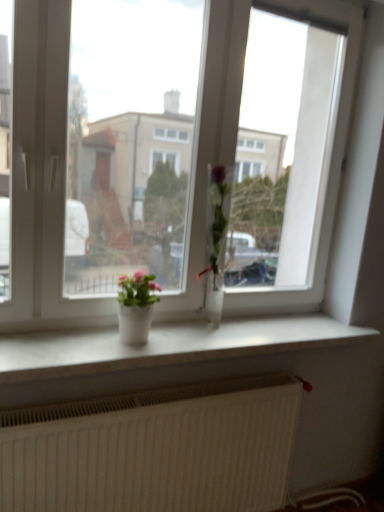
Question: Does clear glass vase at center, marked as the first houseplant in a right-to-left arrangement, have a greater width compared to white textured radiator at lower center?

Choices:
 (A) no
 (B) yes

Answer: (A)

Question: Is clear glass vase at center, marked as the first houseplant in a right-to-left arrangement, taller than white textured radiator at lower center?

Choices:
 (A) yes
 (B) no

Answer: (A)

Question: Does clear glass vase at center, which is counted as the 2th houseplant, starting from the left, have a lesser height compared to white textured radiator at lower center?

Choices:
 (A) no
 (B) yes

Answer: (A)

Question: From a real-world perspective, is clear glass vase at center, which is counted as the 2th houseplant, starting from the left, physically above white textured radiator at lower center?

Choices:
 (A) yes
 (B) no

Answer: (A)

Question: Considering the relative positions of clear glass vase at center, which is counted as the 2th houseplant, starting from the left, and white textured radiator at lower center in the image provided, is clear glass vase at center, which is counted as the 2th houseplant, starting from the left, behind white textured radiator at lower center?

Choices:
 (A) yes
 (B) no

Answer: (A)

Question: Considering the relative positions of clear glass vase at center, marked as the first houseplant in a right-to-left arrangement, and white textured radiator at lower center in the image provided, is clear glass vase at center, marked as the first houseplant in a right-to-left arrangement, to the right of white textured radiator at lower center from the viewer's perspective?

Choices:
 (A) no
 (B) yes

Answer: (B)

Question: From the image's perspective, does transparent glass window at center appear higher than white textured radiator at lower center?

Choices:
 (A) yes
 (B) no

Answer: (A)

Question: Can you see transparent glass window at center touching white textured radiator at lower center?

Choices:
 (A) yes
 (B) no

Answer: (B)

Question: Is transparent glass window at center at the left side of white textured radiator at lower center?

Choices:
 (A) yes
 (B) no

Answer: (B)

Question: Does transparent glass window at center contain white textured radiator at lower center?

Choices:
 (A) yes
 (B) no

Answer: (B)

Question: Is transparent glass window at center bigger than white textured radiator at lower center?

Choices:
 (A) yes
 (B) no

Answer: (A)

Question: Is transparent glass window at center closer to camera compared to white textured radiator at lower center?

Choices:
 (A) yes
 (B) no

Answer: (A)

Question: Is matte white pot at center, arranged as the first houseplant when viewed from the left, shorter than clear glass vase at center, which is counted as the 2th houseplant, starting from the left?

Choices:
 (A) no
 (B) yes

Answer: (B)